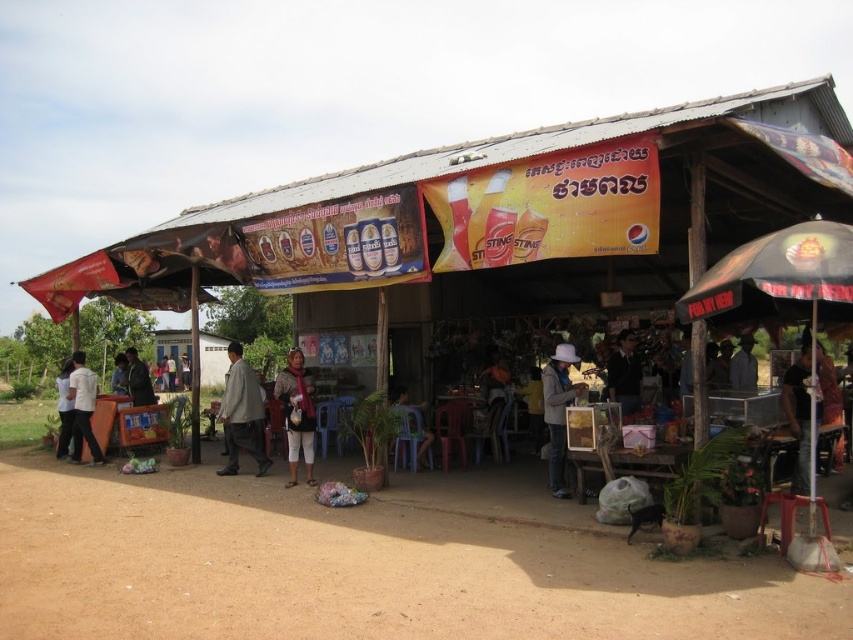
Does point (254, 429) come in front of point (392, 401)?

No.

Is light brown fabric jacket at center shorter than plastic chair at center?

In fact, light brown fabric jacket at center may be taller than plastic chair at center.

I want to click on light brown fabric jacket at center, so click(x=241, y=413).

Identify the location of light brown fabric jacket at center. (241, 413).

Is point (614, 371) more distant than point (125, 349)?

No, (614, 371) is closer to viewer.

Is black matte jacket at center thinner than dark gray suit at left?

Yes.

At what (x,y) coordinates should I click in order to perform the action: click on black matte jacket at center. Please return your answer as a coordinate pair (x, y). This screenshot has width=853, height=640. Looking at the image, I should click on (624, 372).

Is brown dirt field at lower center above white felt hat at center?

No, brown dirt field at lower center is not above white felt hat at center.

Is brown dirt field at lower center shorter than white felt hat at center?

Yes, brown dirt field at lower center is shorter than white felt hat at center.

The height and width of the screenshot is (640, 853). Describe the element at coordinates (352, 570) in the screenshot. I see `brown dirt field at lower center` at that location.

The image size is (853, 640). I want to click on brown dirt field at lower center, so click(x=352, y=570).